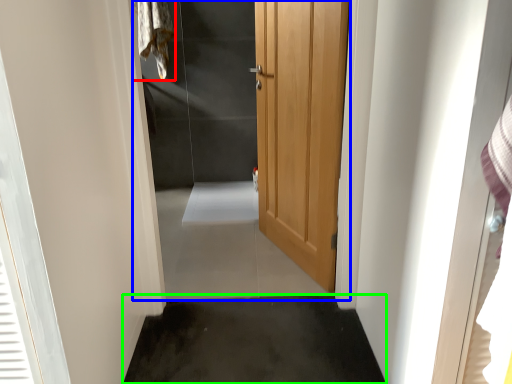
Question: Which is farther away from laundry (highlighted by a red box)? elevator (highlighted by a blue box) or concrete (highlighted by a green box)?

Choices:
 (A) elevator
 (B) concrete

Answer: (B)